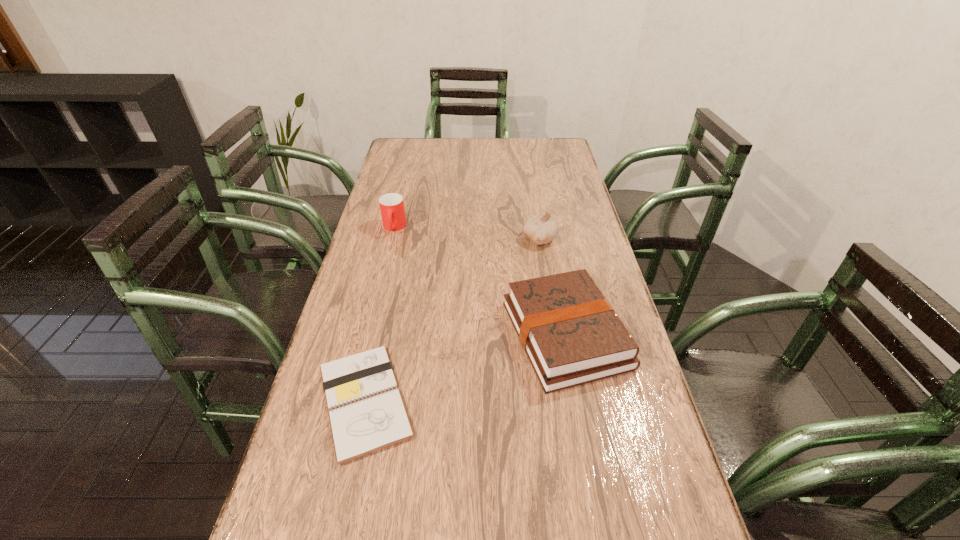
Locate an element on the screen. This screenshot has height=540, width=960. garlic is located at coordinates (541, 229).

The width and height of the screenshot is (960, 540). What are the coordinates of `cup` in the screenshot? It's located at (391, 205).

Locate an element on the screen. The width and height of the screenshot is (960, 540). the third tallest object is located at coordinates (572, 336).

Identify the location of the shortest object. (368, 413).

Locate an element on the screen. vacant area situated on the back of the garlic is located at coordinates (535, 210).

This screenshot has height=540, width=960. I want to click on vacant region located 0.080m on the side of the cup with the handle, so click(388, 253).

This screenshot has height=540, width=960. I want to click on vacant region located on the front of the third tallest object, so click(588, 450).

Find the location of a particular element. This screenshot has height=540, width=960. free spot located on the right of the notepad is located at coordinates [491, 401].

Find the location of a particular element. cup at the left edge is located at coordinates (391, 205).

This screenshot has width=960, height=540. Find the location of `notepad positioned at the left edge`. notepad positioned at the left edge is located at coordinates (368, 413).